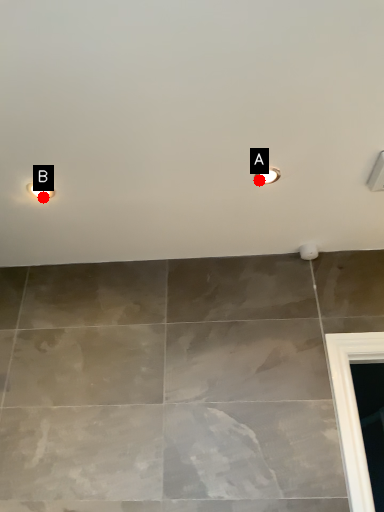
Question: Two points are circled on the image, labeled by A and B beside each circle. Which point appears farthest from the camera in this image?

Choices:
 (A) A is further
 (B) B is further

Answer: (B)